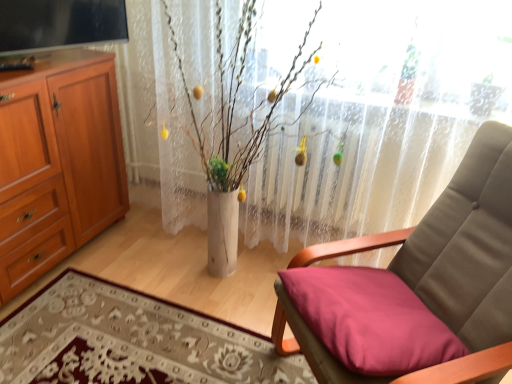
I want to click on empty space that is ontop of smooth fabric cushion at lower right (from a real-world perspective), so click(112, 334).